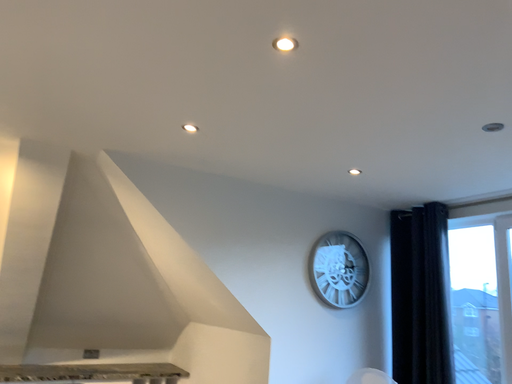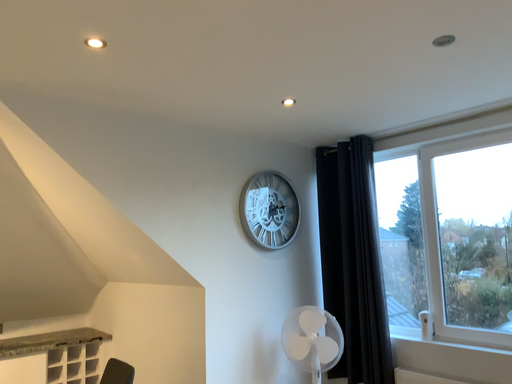
Question: How did the camera likely rotate when shooting the video?

Choices:
 (A) rotated left
 (B) rotated right

Answer: (B)